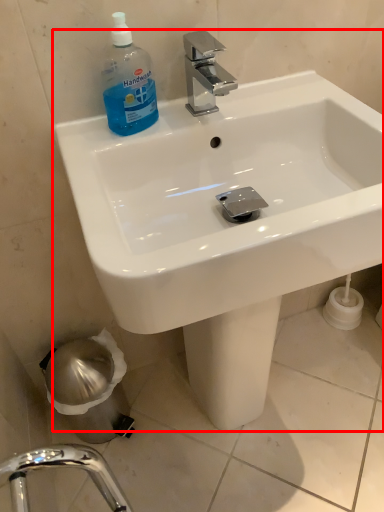
Question: In this image, where is sink (annotated by the red box) located relative to cleaning product?

Choices:
 (A) left
 (B) right

Answer: (B)